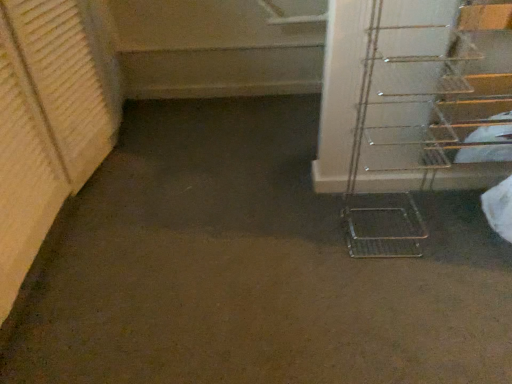
Where is `metal wire rack at right`? metal wire rack at right is located at coordinates (426, 124).

In order to face metal wire rack at right, should I rotate leftwards or rightwards?

Turn right approximately 18.679 degrees to face it.

What do you see at coordinates (426, 124) in the screenshot? This screenshot has height=384, width=512. I see `metal wire rack at right` at bounding box center [426, 124].

Identify the location of metal wire rack at right. (426, 124).